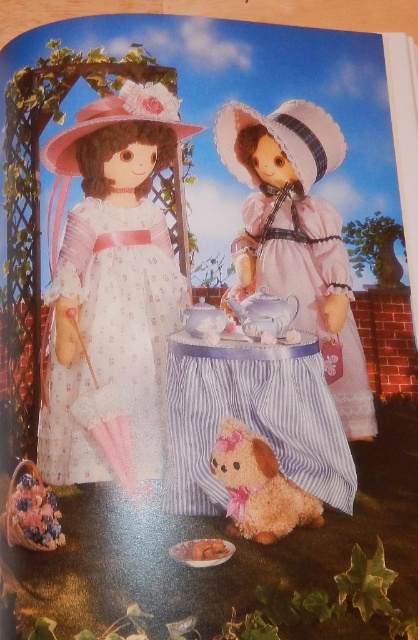
Which of these two, white floral fabric dress at left or striped fabric table at center, stands taller?

Standing taller between the two is white floral fabric dress at left.

Is point (109, 474) closer to camera compared to point (196, 472)?

Yes, point (109, 474) is in front of point (196, 472).

Find the location of a particular element. The height and width of the screenshot is (640, 418). white floral fabric dress at left is located at coordinates (112, 346).

Does fluffy beige plush dog at lower center have a greater width compared to brown plush toy at lower center?

Yes.

Does fluffy beige plush dog at lower center have a larger size compared to brown plush toy at lower center?

Correct, fluffy beige plush dog at lower center is larger in size than brown plush toy at lower center.

Which is behind, point (265, 477) or point (193, 556)?

Point (265, 477)

Where is `fluffy beige plush dog at lower center`? This screenshot has height=640, width=418. fluffy beige plush dog at lower center is located at coordinates (259, 486).

Which is below, striped fabric table at center or brown plush toy at lower center?

brown plush toy at lower center is lower down.

Can you confirm if striped fabric table at center is positioned to the left of brown plush toy at lower center?

In fact, striped fabric table at center is to the right of brown plush toy at lower center.

The height and width of the screenshot is (640, 418). Identify the location of striped fabric table at center. (252, 419).

Locate an element on the screen. striped fabric table at center is located at coordinates (252, 419).